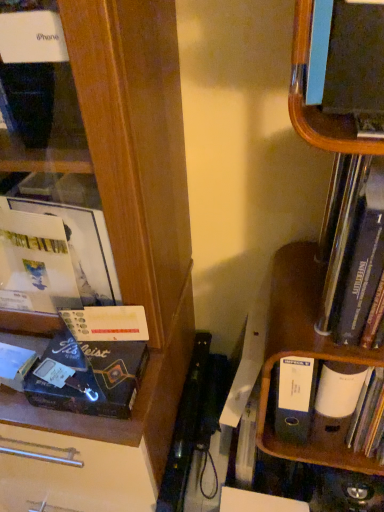
What do you see at coordinates (307, 357) in the screenshot? Image resolution: width=384 pixels, height=512 pixels. I see `blue cardboard file at lower right` at bounding box center [307, 357].

What do you see at coordinates (315, 106) in the screenshot? The image size is (384, 512). I see `matte black bookshelf at upper right, which is the second shelf in bottom-to-top order` at bounding box center [315, 106].

What do you see at coordinates (305, 353) in the screenshot?
I see `wooden bookshelf at right, acting as the second shelf starting from the top` at bounding box center [305, 353].

Locate an element on the screen. The image size is (384, 512). blue cardboard file at lower right is located at coordinates (307, 357).

Is point (89, 312) closer or farther from the camera than point (284, 271)?

Point (89, 312).

Is black cardboard book at left in contact with blue cardboard file at lower right?

No, black cardboard book at left is not with blue cardboard file at lower right.

What's the angular difference between black cardboard book at left and blue cardboard file at lower right's facing directions?

black cardboard book at left and blue cardboard file at lower right are facing 0.86 degrees away from each other.

From a real-world perspective, is wooden bookshelf at right, the 1th shelf when ordered from bottom to top, located beneath matte black bookshelf at upper right, which is counted as the 1th shelf, starting from the top?

Yes, from a real-world perspective, wooden bookshelf at right, the 1th shelf when ordered from bottom to top, is below matte black bookshelf at upper right, which is counted as the 1th shelf, starting from the top.

Considering the relative sizes of wooden bookshelf at right, acting as the second shelf starting from the top, and matte black bookshelf at upper right, which is the second shelf in bottom-to-top order, in the image provided, is wooden bookshelf at right, acting as the second shelf starting from the top, taller than matte black bookshelf at upper right, which is the second shelf in bottom-to-top order,?

Yes.

Is wooden bookshelf at right, acting as the second shelf starting from the top, situated inside matte black bookshelf at upper right, which is counted as the 1th shelf, starting from the top, or outside?

wooden bookshelf at right, acting as the second shelf starting from the top, is located beyond the bounds of matte black bookshelf at upper right, which is counted as the 1th shelf, starting from the top.

Can you see wooden bookshelf at right, the 1th shelf when ordered from bottom to top, touching matte black bookshelf at upper right, which is the second shelf in bottom-to-top order?

No, wooden bookshelf at right, the 1th shelf when ordered from bottom to top, is not making contact with matte black bookshelf at upper right, which is the second shelf in bottom-to-top order.

Is the depth of blue cardboard file at lower right greater than that of black cardboard book at left?

→ That is True.

Looking at their sizes, would you say blue cardboard file at lower right is wider or thinner than black cardboard book at left?

Considering their sizes, blue cardboard file at lower right looks broader than black cardboard book at left.

Between blue cardboard file at lower right and black cardboard book at left, which one appears on the right side from the viewer's perspective?

From the viewer's perspective, blue cardboard file at lower right appears more on the right side.

From a real-world perspective, is blue cardboard file at lower right positioned above or below black cardboard book at left?

blue cardboard file at lower right is below black cardboard book at left.

From the image's perspective, between hardcover book at right and matte black bookshelf at upper right, which is the second shelf in bottom-to-top order, which one is located above?

From the image's view, matte black bookshelf at upper right, which is the second shelf in bottom-to-top order, is above.

Is hardcover book at right facing towards matte black bookshelf at upper right, which is counted as the 1th shelf, starting from the top?

No, hardcover book at right is not turned towards matte black bookshelf at upper right, which is counted as the 1th shelf, starting from the top.

Considering the positions of points (347, 177) and (318, 114), is point (347, 177) closer to camera compared to point (318, 114)?

No, (347, 177) is further to viewer.

Between hardcover book at right and matte black bookshelf at upper right, which is the second shelf in bottom-to-top order, which one has more height?

Standing taller between the two is hardcover book at right.

From the image's perspective, is hardcover book at right below wooden bookshelf at right, acting as the second shelf starting from the top?

Incorrect, from the image's perspective, hardcover book at right is higher than wooden bookshelf at right, acting as the second shelf starting from the top.

Could you tell me if hardcover book at right is facing wooden bookshelf at right, the 1th shelf when ordered from bottom to top?

Yes.

You are a GUI agent. You are given a task and a screenshot of the screen. Output one action in this format:
    pyautogui.click(x=<x>, y=<y>)
    Task: Click on the shelf lying on the right of hardcover book at right
    The height and width of the screenshot is (512, 384).
    Given the screenshot: What is the action you would take?
    [305, 353]

From the image's perspective, is wooden bookshelf at right, the 1th shelf when ordered from bottom to top, on top of blue cardboard file at lower right?

Indeed, from the image's perspective, wooden bookshelf at right, the 1th shelf when ordered from bottom to top, is shown above blue cardboard file at lower right.

Can you see wooden bookshelf at right, the 1th shelf when ordered from bottom to top, touching blue cardboard file at lower right?

Yes, the surface of wooden bookshelf at right, the 1th shelf when ordered from bottom to top, is in contact with blue cardboard file at lower right.

Between wooden bookshelf at right, the 1th shelf when ordered from bottom to top, and blue cardboard file at lower right, which one has smaller size?

With smaller size is blue cardboard file at lower right.

This screenshot has width=384, height=512. I want to click on cabinet located below the wooden bookshelf at right, the 1th shelf when ordered from bottom to top (from the image's perspective), so click(x=307, y=357).

Between wooden bookshelf at right, acting as the second shelf starting from the top, and black cardboard book at left, which one appears on the left side from the viewer's perspective?

From the viewer's perspective, black cardboard book at left appears more on the left side.

Where is `the 2nd shelf counting from the right of the black cardboard book at left`? Image resolution: width=384 pixels, height=512 pixels. the 2nd shelf counting from the right of the black cardboard book at left is located at coordinates coord(305,353).

Is wooden bookshelf at right, acting as the second shelf starting from the top, behind black cardboard book at left?

That is False.

Considering the relative sizes of wooden bookshelf at right, the 1th shelf when ordered from bottom to top, and black cardboard book at left in the image provided, is wooden bookshelf at right, the 1th shelf when ordered from bottom to top, taller than black cardboard book at left?

Correct, wooden bookshelf at right, the 1th shelf when ordered from bottom to top, is much taller as black cardboard book at left.

The height and width of the screenshot is (512, 384). What are the coordinates of `cabinet located on the right of black cardboard book at left` in the screenshot? It's located at (307, 357).

Where is `shelf above the wooden bookshelf at right, the 1th shelf when ordered from bottom to top (from the image's perspective)`? shelf above the wooden bookshelf at right, the 1th shelf when ordered from bottom to top (from the image's perspective) is located at coordinates (315, 106).

Based on their spatial positions, is blue cardboard file at lower right or hardcover book at right further from matte black bookshelf at upper right, which is counted as the 1th shelf, starting from the top?

blue cardboard file at lower right.

Considering their positions, is blue cardboard file at lower right positioned closer to hardcover book at right than matte black bookshelf at upper right, which is counted as the 1th shelf, starting from the top?

The object closer to hardcover book at right is blue cardboard file at lower right.

Based on their spatial positions, is black cardboard book at left or wooden bookshelf at right, the 1th shelf when ordered from bottom to top, closer to matte black bookshelf at upper right, which is the second shelf in bottom-to-top order?

Based on the image, wooden bookshelf at right, the 1th shelf when ordered from bottom to top, appears to be nearer to matte black bookshelf at upper right, which is the second shelf in bottom-to-top order.

Consider the image. Estimate the real-world distances between objects in this image. Which object is further from matte black bookshelf at upper right, which is the second shelf in bottom-to-top order, wooden bookshelf at right, acting as the second shelf starting from the top, or blue cardboard file at lower right?

The object further to matte black bookshelf at upper right, which is the second shelf in bottom-to-top order, is blue cardboard file at lower right.

Estimate the real-world distances between objects in this image. Which object is further from wooden bookshelf at right, acting as the second shelf starting from the top, hardcover book at right or matte black bookshelf at upper right, which is the second shelf in bottom-to-top order?

matte black bookshelf at upper right, which is the second shelf in bottom-to-top order, is further to wooden bookshelf at right, acting as the second shelf starting from the top.

From the image, which object appears to be farther from matte black bookshelf at upper right, which is counted as the 1th shelf, starting from the top, black cardboard book at left or blue cardboard file at lower right?

The object further to matte black bookshelf at upper right, which is counted as the 1th shelf, starting from the top, is black cardboard book at left.

Looking at the image, which one is located closer to hardcover book at right, matte black bookshelf at upper right, which is the second shelf in bottom-to-top order, or wooden bookshelf at right, the 1th shelf when ordered from bottom to top?

wooden bookshelf at right, the 1th shelf when ordered from bottom to top, lies closer to hardcover book at right than the other object.

Estimate the real-world distances between objects in this image. Which object is further from blue cardboard file at lower right, wooden bookshelf at right, the 1th shelf when ordered from bottom to top, or matte black bookshelf at upper right, which is counted as the 1th shelf, starting from the top?

matte black bookshelf at upper right, which is counted as the 1th shelf, starting from the top, is positioned further to the anchor blue cardboard file at lower right.

This screenshot has width=384, height=512. I want to click on book between matte black bookshelf at upper right, which is counted as the 1th shelf, starting from the top, and blue cardboard file at lower right, in the vertical direction, so pyautogui.click(x=355, y=254).

Locate an element on the screen. The image size is (384, 512). paperback book between matte black bookshelf at upper right, which is counted as the 1th shelf, starting from the top, and blue cardboard file at lower right in the up-down direction is located at coordinates (95, 362).

You are a GUI agent. You are given a task and a screenshot of the screen. Output one action in this format:
    pyautogui.click(x=<x>, y=<y>)
    Task: Click on the book between wooden bookshelf at right, acting as the second shelf starting from the top, and blue cardboard file at lower right in the front-back direction
    The width and height of the screenshot is (384, 512).
    Given the screenshot: What is the action you would take?
    pyautogui.click(x=355, y=254)

Identify the location of book between black cardboard book at left and wooden bookshelf at right, acting as the second shelf starting from the top. (355, 254).